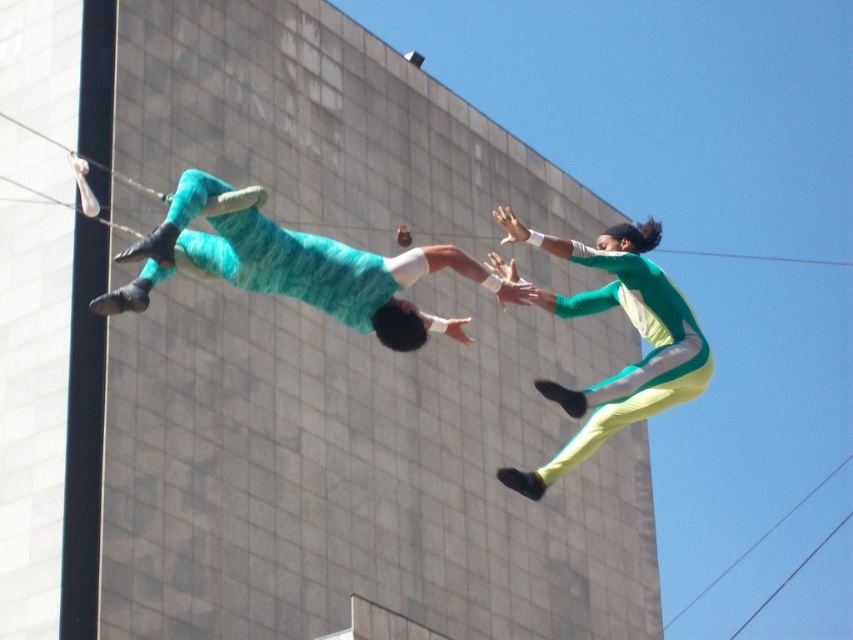
You are a stage director observing the acrobatic performance. You need to ensure the teal fabric body at center and the green matte jumpsuit at upper right are positioned correctly for the next stunt. Based on their current heights, which one should you instruct to lower their position to align them at the same level?

The teal fabric body at center has a lesser height compared to the green matte jumpsuit at upper right, so you should instruct the teal fabric body at center to lower its position to align them at the same level.

You are a costume designer trying to fit a new outfit for the teal fabric body at center and the green matte jumpsuit at upper right. Given their widths, which outfit requires a wider fabric piece?

The teal fabric body at center requires a wider fabric piece since its width surpasses that of the green matte jumpsuit at upper right.

Looking at this image, you are a costume designer reviewing the performance scene. You need to determine which costume requires more fabric based on their sizes. Which one between the teal fabric body at center and the green matte jumpsuit at upper right needs more fabric?

The green matte jumpsuit at upper right requires more fabric because it has a larger size than the teal fabric body at center.